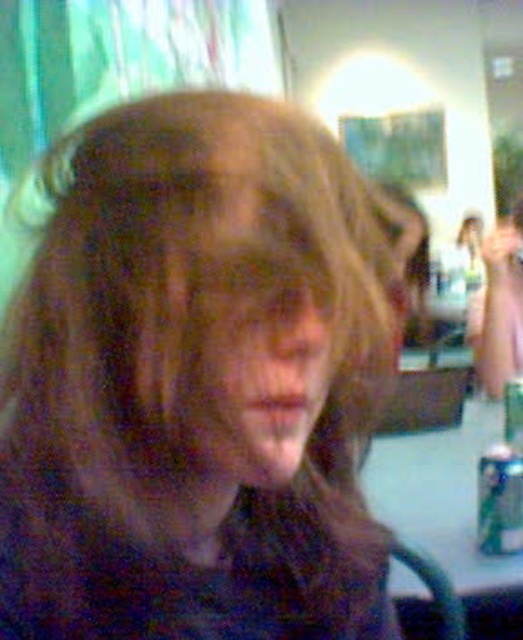
You are a stylist trying to take a photo of a client. You need to ensure that the brown matte hair at center and the smooth skin face at center are both visible in the frame. Based on their positions, which one will appear larger in the photo?

The brown matte hair at center will appear larger in the photo because it is taller than the smooth skin face at center.

You are a stylist trying to place a hair accessory exactly at the center of the brown matte hair at center. According to the image, what are the coordinates where you should place the accessory?

The coordinates for the center of the brown matte hair at center are at point (198, 381), so you should place the accessory there.